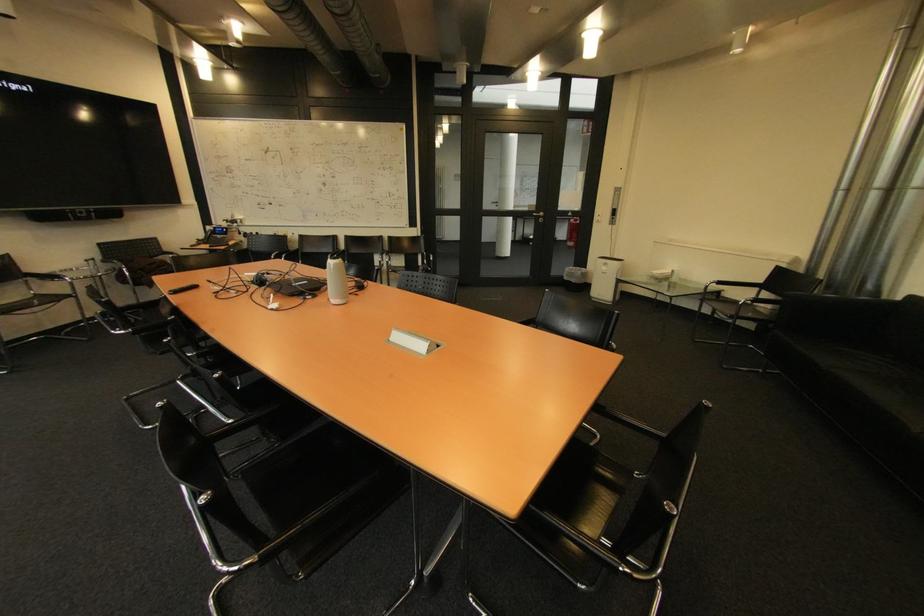
Identify the location of sofa sitting surface. This screenshot has width=924, height=616. (880, 379).